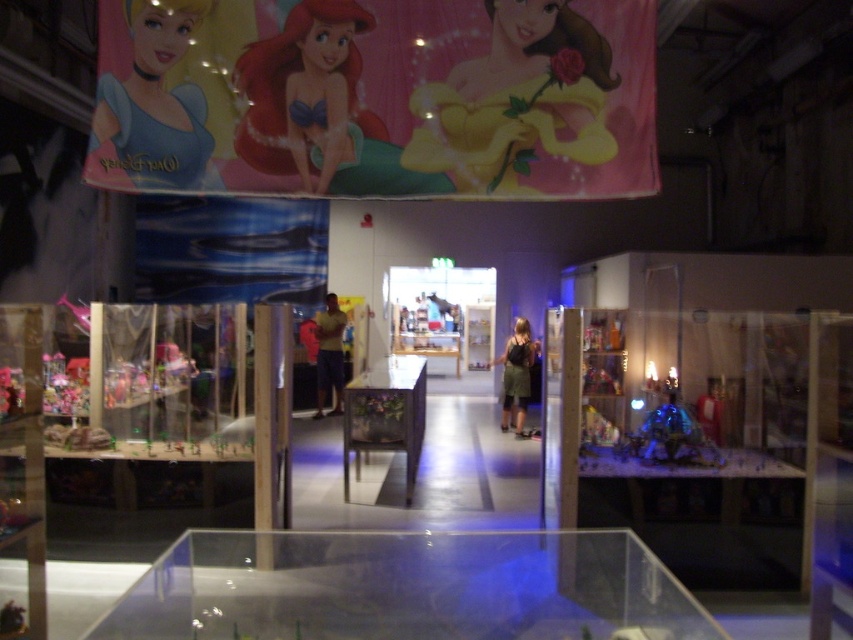
From the picture: You are a customer in the store and want to know which item is shorter between the pink satin dress at upper center and the yellow cotton shirt at center. Can you tell me?

The pink satin dress at upper center is shorter than the yellow cotton shirt at center.

You are a customer in a store and want to find the dark green fabric dress at center. You see the matte blue dress at upper left. Which dress is located to the left of the other?

The matte blue dress at upper left is positioned on the left side of dark green fabric dress at center.

You are standing in the store and see the point at coordinates (698, 435). What object is this point located on?

The point at coordinates (698, 435) is located on the transparent plastic display case at right.